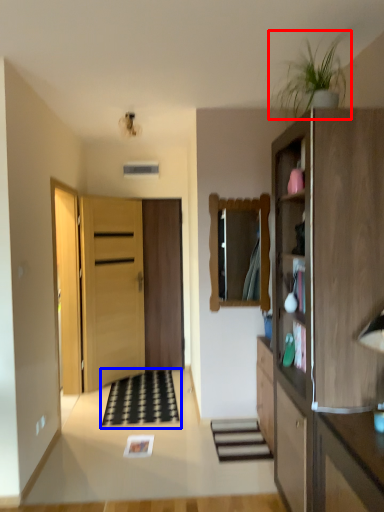
Question: Which object appears farthest to the camera in this image, plant (highlighted by a red box) or doormat (highlighted by a blue box)?

Choices:
 (A) plant
 (B) doormat

Answer: (B)